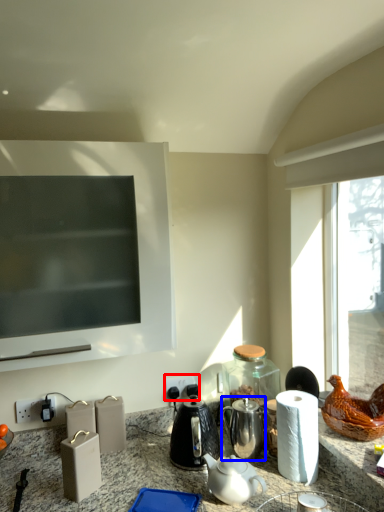
Question: Which point is closer to the camera, electric outlet (highlighted by a red box) or tea pot (highlighted by a blue box)?

Choices:
 (A) electric outlet
 (B) tea pot

Answer: (B)